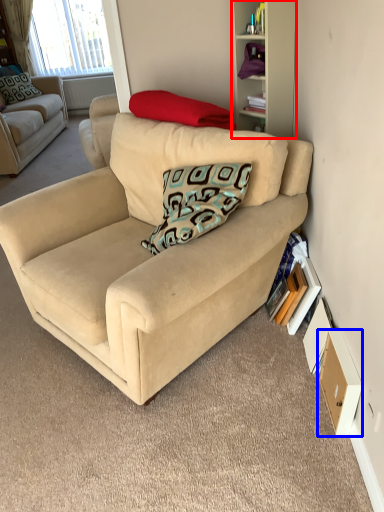
Question: Which point is further to the camera, cabinet (highlighted by a red box) or drawer (highlighted by a blue box)?

Choices:
 (A) cabinet
 (B) drawer

Answer: (A)